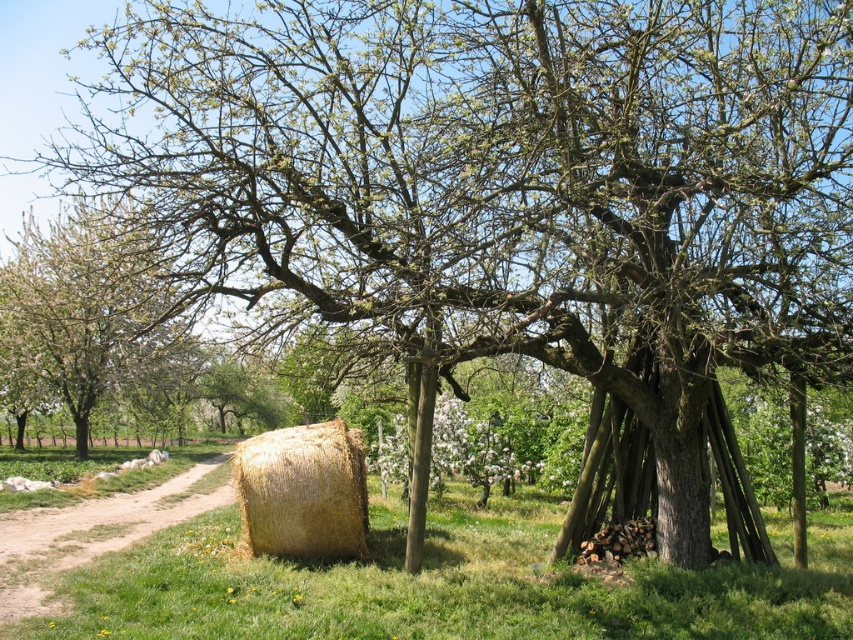
Who is more distant from viewer, (496, 516) or (277, 508)?

The point (496, 516) is behind.

Is point (809, 570) more distant than point (279, 436)?

No, it is not.

I want to click on green grass at lower left, so click(x=447, y=586).

You are a GUI agent. You are given a task and a screenshot of the screen. Output one action in this format:
    pyautogui.click(x=<x>, y=<y>)
    Task: Click on the green grass at lower left
    The width and height of the screenshot is (853, 640).
    Given the screenshot: What is the action you would take?
    pyautogui.click(x=447, y=586)

Measure the distance between white blossoming tree at center and camera.

white blossoming tree at center and camera are 6.79 meters apart from each other.

Can you confirm if white blossoming tree at center is smaller than brown dirt track at lower left?

Incorrect, white blossoming tree at center is not smaller in size than brown dirt track at lower left.

The width and height of the screenshot is (853, 640). I want to click on white blossoming tree at center, so click(x=80, y=308).

Between green grass at lower left and white blossoming tree at center, which one is positioned higher?

white blossoming tree at center

Between green grass at lower left and white blossoming tree at center, which one appears on the right side from the viewer's perspective?

From the viewer's perspective, green grass at lower left appears more on the right side.

The image size is (853, 640). Describe the element at coordinates (447, 586) in the screenshot. I see `green grass at lower left` at that location.

Find the location of `green grass at lower left`. green grass at lower left is located at coordinates (447, 586).